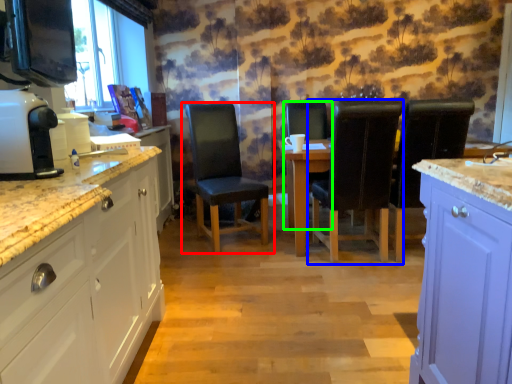
Question: Which object is positioned farthest from chair (highlighted by a red box)? Select from chair (highlighted by a blue box) and chair (highlighted by a green box).

Choices:
 (A) chair
 (B) chair

Answer: (B)